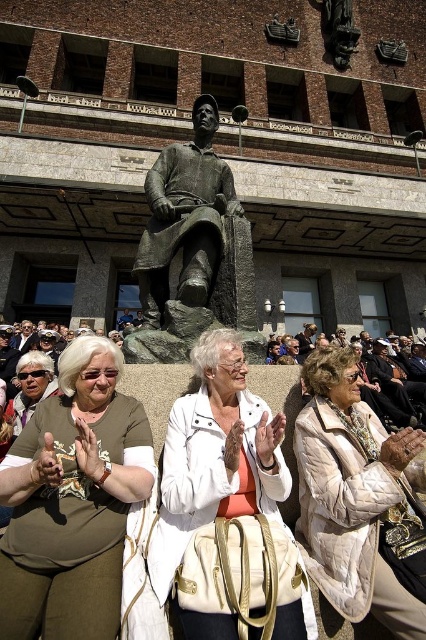
Looking at this image, you are organizing a photo shoot and need to ensure that the beige quilted coat at center and the bronze statue at center can be captured in the same frame. Based on their sizes, which object should be placed closer to the camera to ensure both fit within the shot?

The beige quilted coat at center is narrower than the bronze statue at center, so placing the bronze statue at center closer to the camera would allow both to fit in the frame since it is wider and requires more space.

You are organizing a small event and need to store two items in a storage box. You have a white leather bag at center and a beige quilted coat at center. Which item will require less space in the storage box?

The white leather bag at center is smaller than the beige quilted coat at center, so it will require less space in the storage box.

You are organizing a photo shoot and need to ensure that the white leather bag at center and the beige quilted coat at center are visible in the final shot. Since they are both at the center, could there be an issue with one blocking the other?

The white leather bag at center is positioned over the beige quilted coat at center, so the coat might be partially or fully obscured by the bag in the photo shoot.